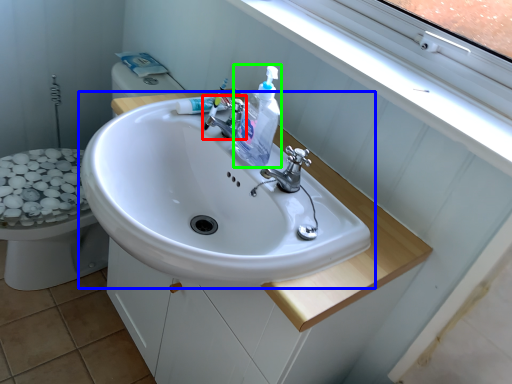
Question: Which object is positioned farthest from tap (highlighted by a red box)? Select from sink (highlighted by a blue box) and cleaning product (highlighted by a green box).

Choices:
 (A) sink
 (B) cleaning product

Answer: (A)